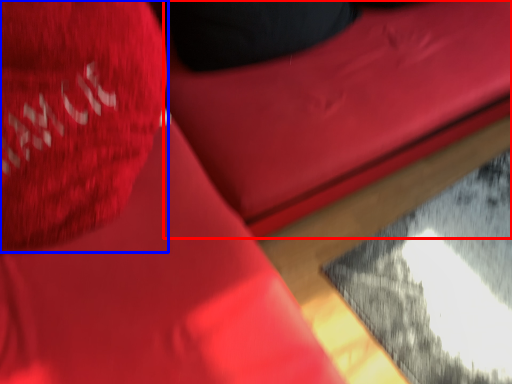
Question: Which point is closer to the camera, bean bag chair (highlighted by a red box) or throw pillow (highlighted by a blue box)?

Choices:
 (A) bean bag chair
 (B) throw pillow

Answer: (B)